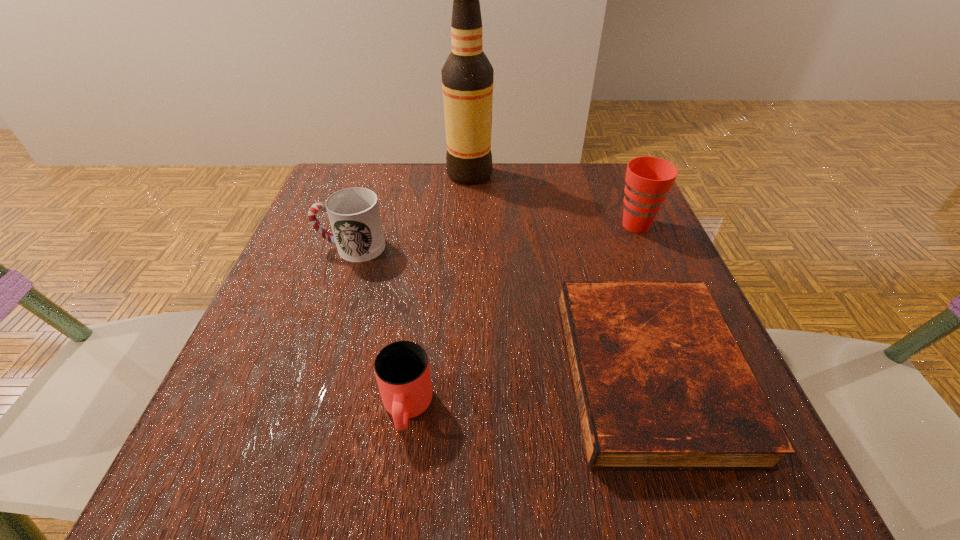
I want to click on Bible located in the right edge section of the desktop, so click(x=661, y=385).

At what (x,y) coordinates should I click in order to perform the action: click on object at the far right corner. Please return your answer as a coordinate pair (x, y). This screenshot has height=540, width=960. Looking at the image, I should click on (648, 179).

The height and width of the screenshot is (540, 960). I want to click on object positioned at the near right corner, so click(x=661, y=385).

At what (x,y) coordinates should I click in order to perform the action: click on vacant area at the far edge of the desktop. Please return your answer as a coordinate pair (x, y). The width and height of the screenshot is (960, 540). Looking at the image, I should click on (526, 191).

What are the coordinates of `vacant space at the right edge` in the screenshot? It's located at (625, 265).

The height and width of the screenshot is (540, 960). Identify the location of vacant region between the alcohol and the shortest object. (560, 273).

At what (x,y) coordinates should I click in order to perform the action: click on vacant region between the alcohol and the shortest object. Please return your answer as a coordinate pair (x, y). The image size is (960, 540). Looking at the image, I should click on (560, 273).

Locate an element on the screen. blank region between the third shortest object and the shortest object is located at coordinates (501, 310).

Find the location of a particular element. The image size is (960, 540). vacant space in between the alcohol and the Bible is located at coordinates tap(560, 273).

This screenshot has width=960, height=540. What are the coordinates of `free space between the second tallest cup and the tallest cup` in the screenshot? It's located at (493, 236).